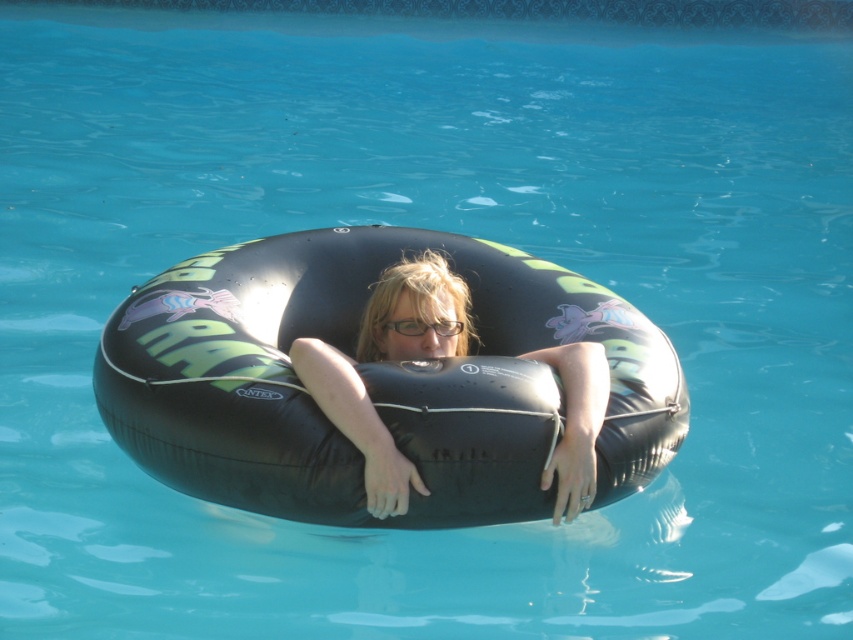
Question: Can you confirm if black rubber tube at center is bigger than clear plastic glasses at center?

Choices:
 (A) yes
 (B) no

Answer: (A)

Question: Which of the following is the farthest from the observer?

Choices:
 (A) (440, 323)
 (B) (387, 433)

Answer: (A)

Question: Considering the relative positions of black rubber tube at center and clear plastic glasses at center in the image provided, where is black rubber tube at center located with respect to clear plastic glasses at center?

Choices:
 (A) above
 (B) below

Answer: (A)

Question: Observing the image, what is the correct spatial positioning of black rubber tube at center in reference to clear plastic glasses at center?

Choices:
 (A) below
 (B) above

Answer: (B)